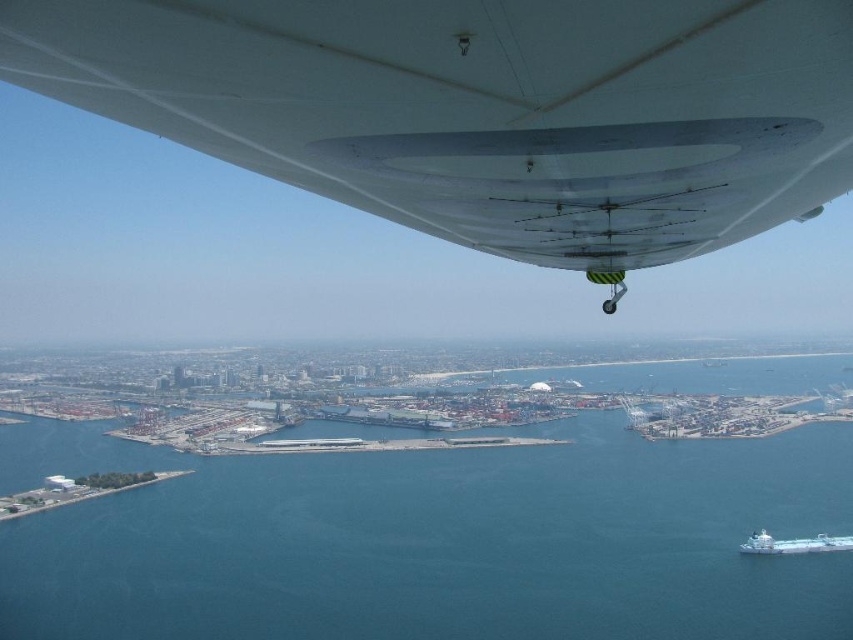
Question: Is white matte wing at upper center in front of white glossy boat at lower right?

Choices:
 (A) no
 (B) yes

Answer: (B)

Question: Which point is farther to the camera?

Choices:
 (A) (753, 536)
 (B) (791, 392)
 (C) (477, 88)

Answer: (B)

Question: Can you confirm if blue water at center is positioned to the left of white glossy boat at lower right?

Choices:
 (A) no
 (B) yes

Answer: (B)

Question: Can you confirm if white matte wing at upper center is positioned below blue water at center?

Choices:
 (A) no
 (B) yes

Answer: (A)

Question: Which of these objects is positioned farthest from the white matte wing at upper center?

Choices:
 (A) blue water at center
 (B) white glossy boat at lower right

Answer: (B)

Question: Which point is closer to the camera?

Choices:
 (A) (239, 592)
 (B) (753, 541)
 (C) (555, 221)

Answer: (C)